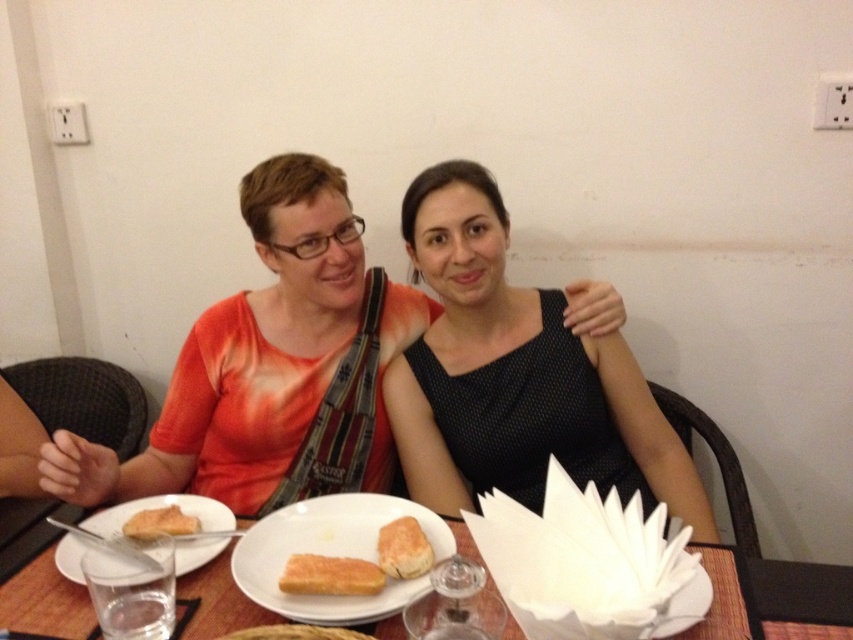
Question: Does golden brown bread at center appear under golden crispy toast at center?

Choices:
 (A) no
 (B) yes

Answer: (A)

Question: Which point is closer to the camera?

Choices:
 (A) golden crispy toast at center
 (B) black dotted dress at center
 (C) golden brown crusty bread at center
 (D) golden brown bread at lower left

Answer: (A)

Question: Which is farther from the black dotted dress at center?

Choices:
 (A) golden crispy toast at center
 (B) golden brown bread at center

Answer: (A)

Question: Is white matte plate at lower left thinner than golden brown crusty bread at center?

Choices:
 (A) yes
 (B) no

Answer: (B)

Question: Is golden brown bread at center thinner than golden crispy toast at center?

Choices:
 (A) yes
 (B) no

Answer: (B)

Question: Which of these objects is positioned closest to the black dotted dress at center?

Choices:
 (A) golden brown crusty bread at center
 (B) white matte plate at lower left
 (C) golden crispy toast at center

Answer: (A)